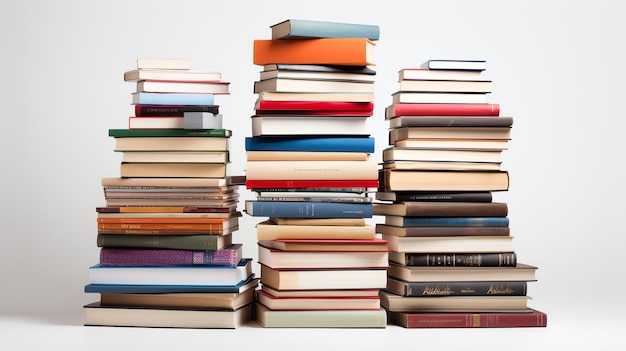
Where is `blue books`? blue books is located at coordinates (341, 207), (327, 27), (193, 97), (449, 221), (221, 284), (106, 290), (340, 142).